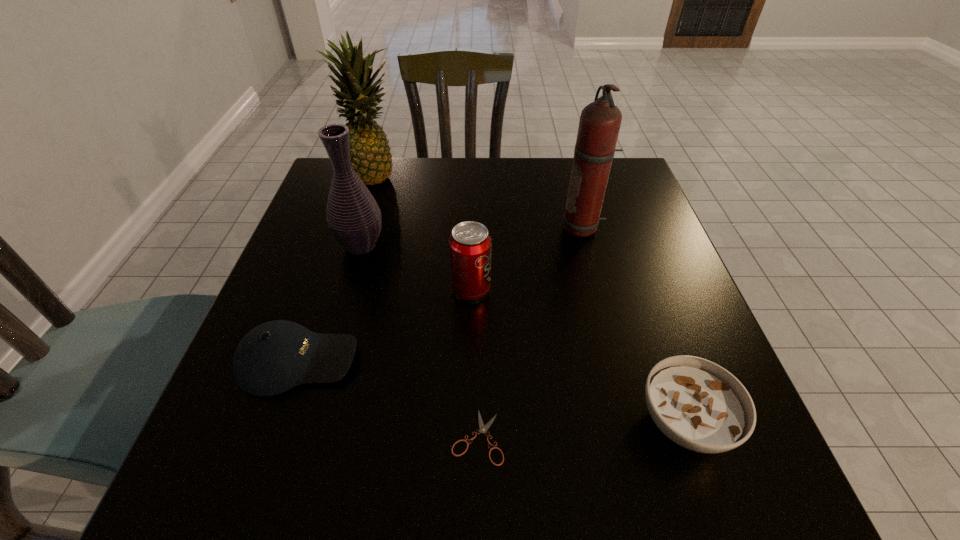
Locate an element on the screen. pineapple is located at coordinates (371, 159).

At what (x,y) coordinates should I click in order to perform the action: click on fire extinguisher. Please return your answer as a coordinate pair (x, y). The height and width of the screenshot is (540, 960). Looking at the image, I should click on (600, 121).

The height and width of the screenshot is (540, 960). I want to click on the fifth shortest object, so click(x=353, y=216).

Where is `the fourth tallest object`? The image size is (960, 540). the fourth tallest object is located at coordinates (470, 244).

I want to click on the fourth nearest object, so click(x=470, y=244).

What are the coordinates of `baseball cap` in the screenshot? It's located at (272, 358).

The height and width of the screenshot is (540, 960). Identify the location of soup bowl. (699, 405).

At what (x,y) coordinates should I click in order to perform the action: click on the shortest object. Please return your answer as a coordinate pair (x, y). Looking at the image, I should click on (483, 429).

Image resolution: width=960 pixels, height=540 pixels. I want to click on vacant space positioned on the front of the farthest object, so click(x=336, y=299).

The image size is (960, 540). I want to click on vacant area situated 0.140m on the side of the fire extinguisher with the label and nozzle, so click(x=504, y=228).